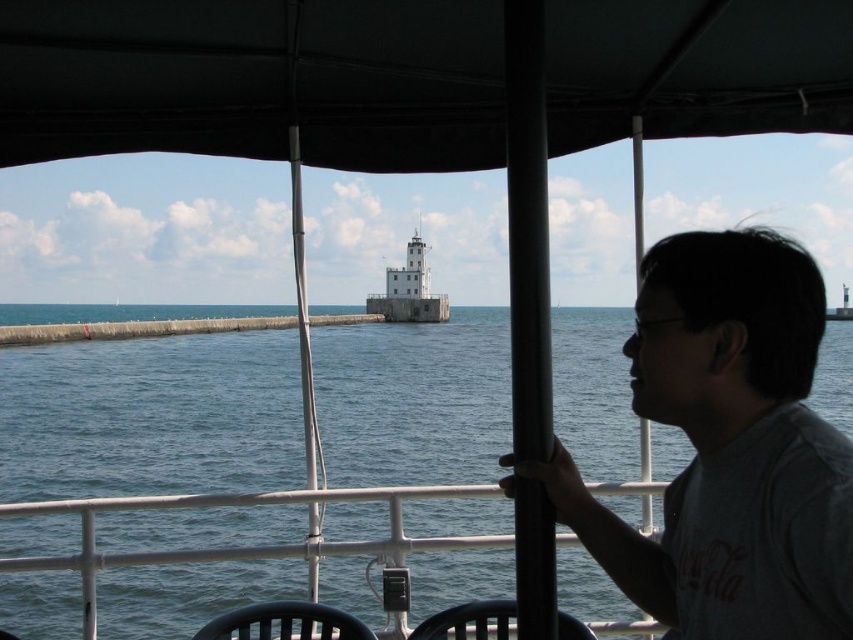
Between point (648, 582) and point (474, 324), which one is positioned in front?

Point (648, 582) is in front.

Which of these two, gray matte shirt at right or blue water at center, stands taller?

blue water at center is taller.

Is point (786, 420) more distant than point (165, 429)?

That is False.

Find the location of a particular element. gray matte shirt at right is located at coordinates (729, 449).

How much distance is there between black fabric canopy at upper center and gray matte shirt at right?

black fabric canopy at upper center and gray matte shirt at right are 7.20 meters apart.

Is black fabric canopy at upper center closer to the viewer compared to gray matte shirt at right?

Yes, black fabric canopy at upper center is in front of gray matte shirt at right.

The height and width of the screenshot is (640, 853). What do you see at coordinates (256, 81) in the screenshot?
I see `black fabric canopy at upper center` at bounding box center [256, 81].

Where is `black fabric canopy at upper center`? This screenshot has width=853, height=640. black fabric canopy at upper center is located at coordinates (256, 81).

Does black fabric canopy at upper center appear on the right side of blue water at center?

Correct, you'll find black fabric canopy at upper center to the right of blue water at center.

Does point (196, 4) come behind point (12, 438)?

No, (196, 4) is closer to viewer.

Where is `black fabric canopy at upper center`? This screenshot has height=640, width=853. black fabric canopy at upper center is located at coordinates (256, 81).